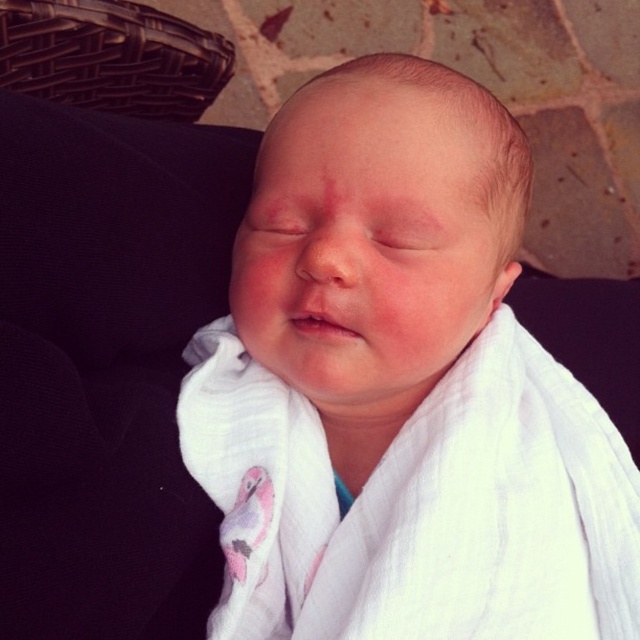
You are a photographer adjusting the focus on your camera. You want to ensure that both points, point (x=442, y=502) and point (x=227, y=80), are in focus. Since the camera can only focus on one point at a time, which point should you choose to maximize the chances of both being in focus?

You should focus on point (x=227, y=80) because it is farther from the camera than point (x=442, y=502). Focusing on the farther point increases the depth of field, making both points more likely to be in focus.

You are a photographer setting up a shoot with a baby wrapped in a white muslin cloth at center and a brown woven basket at upper left. You need to position a small prop between them. Based on their positions, where should you place the prop?

The white muslin cloth at center is located below the brown woven basket at upper left, so you should place the prop between them in the middle area between the cloth and the basket.